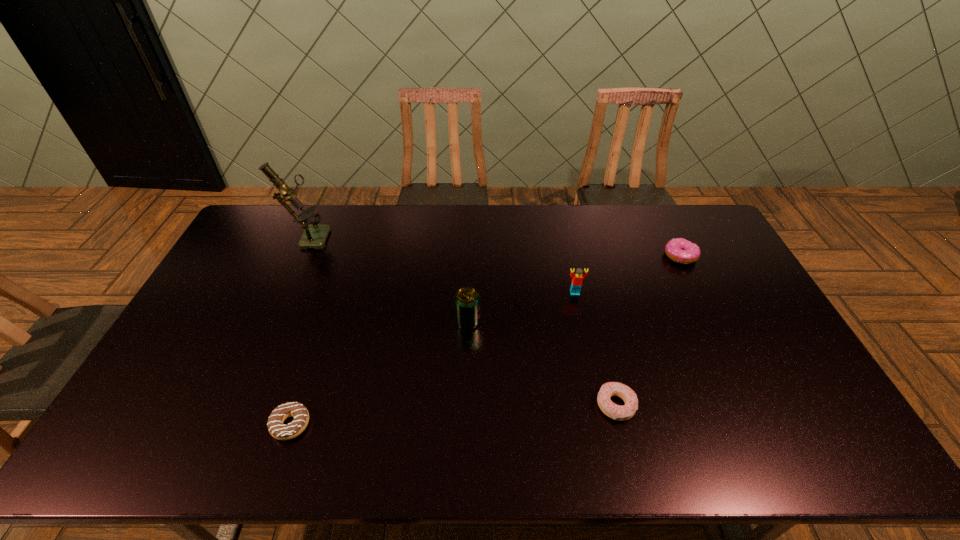
Find the location of a particular element. the leftmost object is located at coordinates (314, 236).

Locate an element on the screen. the tallest object is located at coordinates (314, 236).

Locate an element on the screen. The width and height of the screenshot is (960, 540). the third object from left to right is located at coordinates (466, 299).

The height and width of the screenshot is (540, 960). Identify the location of beer can. (466, 299).

Find the location of a particular element. This screenshot has width=960, height=540. the third farthest object is located at coordinates (577, 278).

Find the location of a particular element. the rightmost doughnut is located at coordinates (679, 250).

At what (x,y) coordinates should I click in order to perform the action: click on the rightmost object. Please return your answer as a coordinate pair (x, y). Looking at the image, I should click on (679, 250).

At what (x,y) coordinates should I click in order to perform the action: click on the second doughnut from left to right. Please return your answer as a coordinate pair (x, y). This screenshot has width=960, height=540. Looking at the image, I should click on (621, 413).

This screenshot has width=960, height=540. I want to click on the fifth object from right to left, so click(x=280, y=431).

Identify the location of free space located at the eyepiece of the leftmost object. (372, 236).